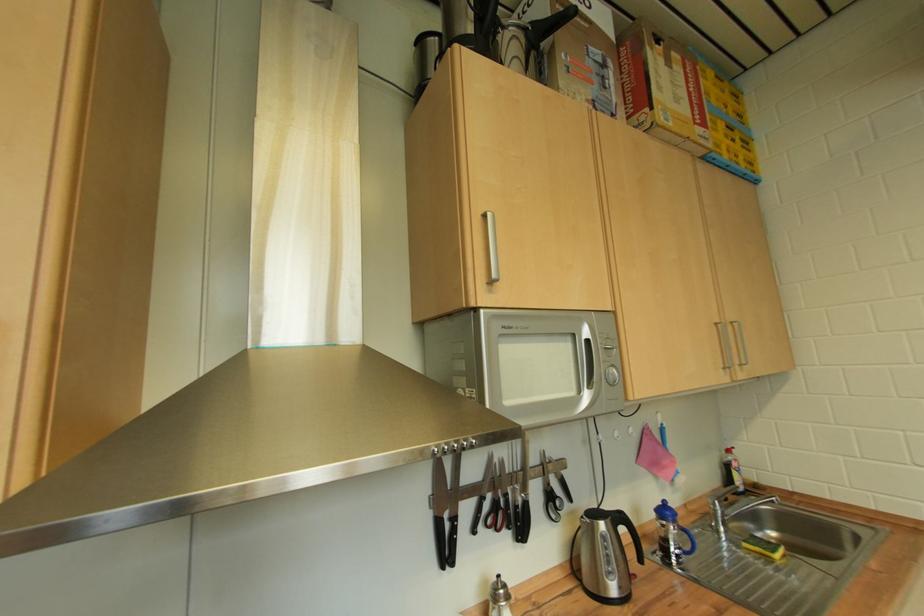
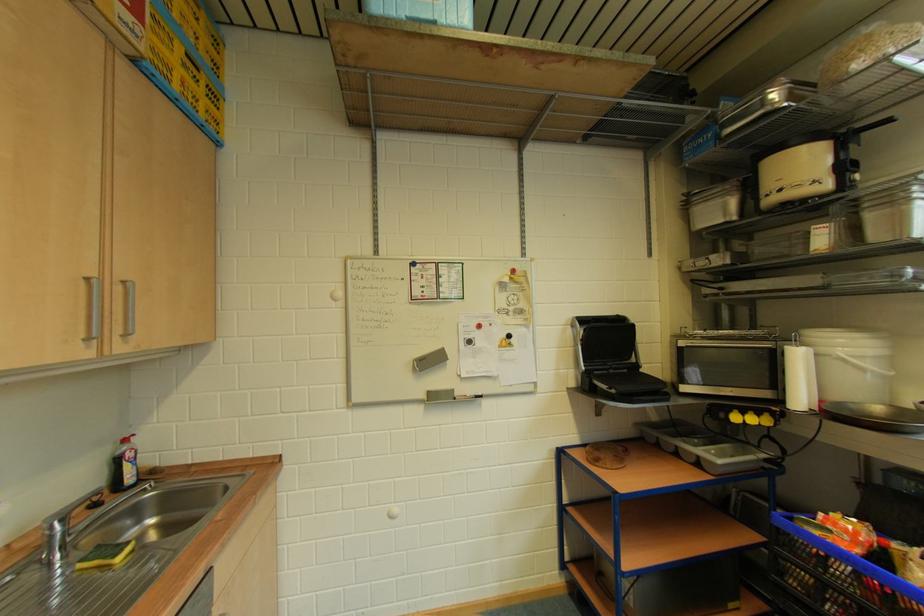
Where in the second image is the point corresponding to point 723,326 from the first image?

(94, 282)